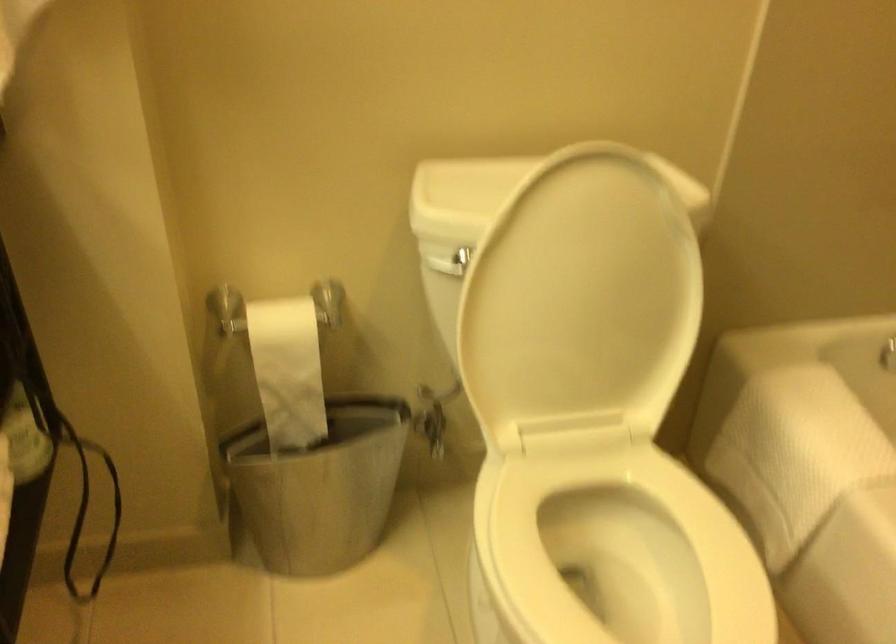
The image size is (896, 644). What do you see at coordinates (581, 301) in the screenshot?
I see `the white toilet lid` at bounding box center [581, 301].